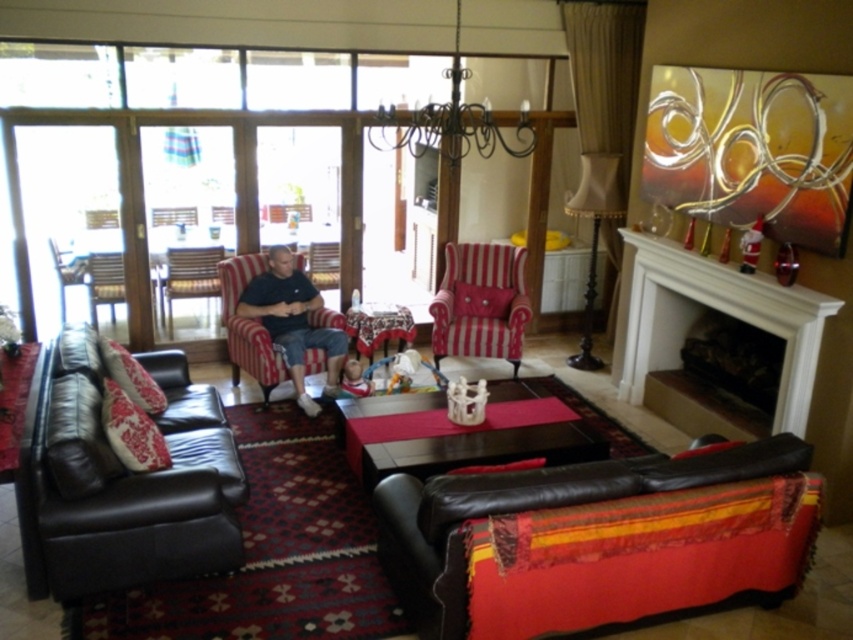
Question: Which object is closer to the camera taking this photo?

Choices:
 (A) white glossy fireplace at upper right
 (B) black leather couch at lower left
 (C) leather couch at lower right

Answer: (C)

Question: Estimate the real-world distances between objects in this image. Which object is closer to the matte black shirt at center?

Choices:
 (A) wooden armchair at center
 (B) dark wood coffee table at center
 (C) leather couch at lower right
 (D) striped fabric armchair at center

Answer: (A)

Question: Is leather couch at lower right to the left of wooden coffee table at center from the viewer's perspective?

Choices:
 (A) yes
 (B) no

Answer: (B)

Question: Estimate the real-world distances between objects in this image. Which object is closer to the striped fabric armchair at center?

Choices:
 (A) white glossy fireplace at upper right
 (B) wooden armchair at left
 (C) dark wood coffee table at center

Answer: (A)

Question: Does black wrought iron chandelier at upper center come in front of wooden coffee table at center?

Choices:
 (A) no
 (B) yes

Answer: (B)

Question: Is dark wood coffee table at center in front of wooden coffee table at center?

Choices:
 (A) yes
 (B) no

Answer: (A)